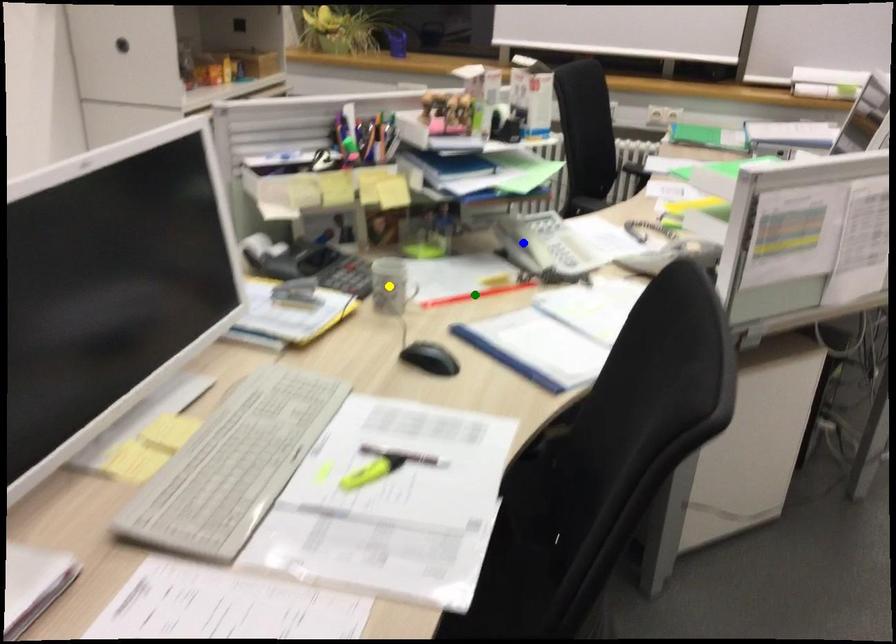
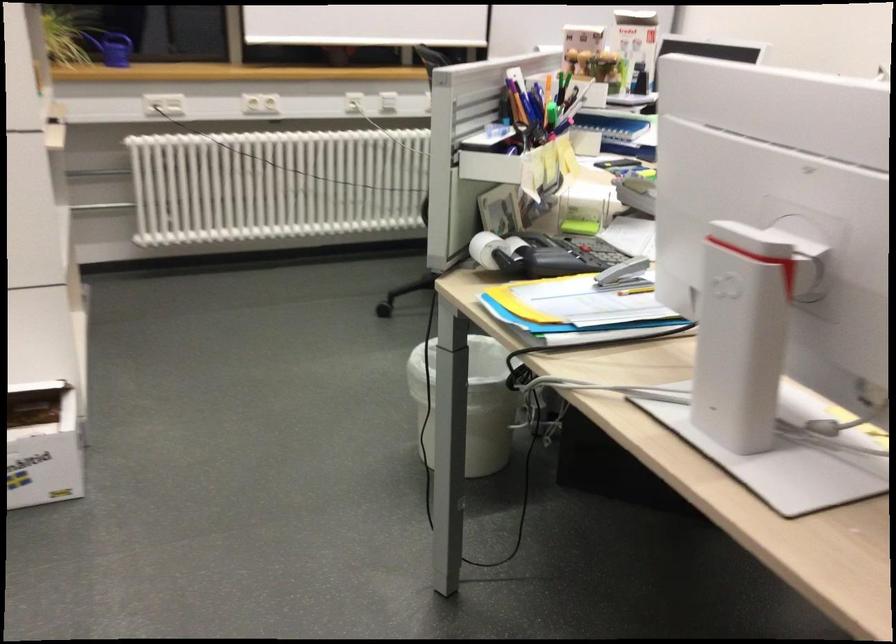
I am providing you with two images of the same scene from different viewpoints. Three points are marked in image1. Which point corresponds to a part or object that is occluded in image2?In image1, three points are marked. Which of them correspond to a part or object that is occluded in image2?Among the three points shown in image1, which one corresponds to a part or object that is no longer visible due to occlusion in image2?

Invisible in image2: green point, yellow point, blue point.